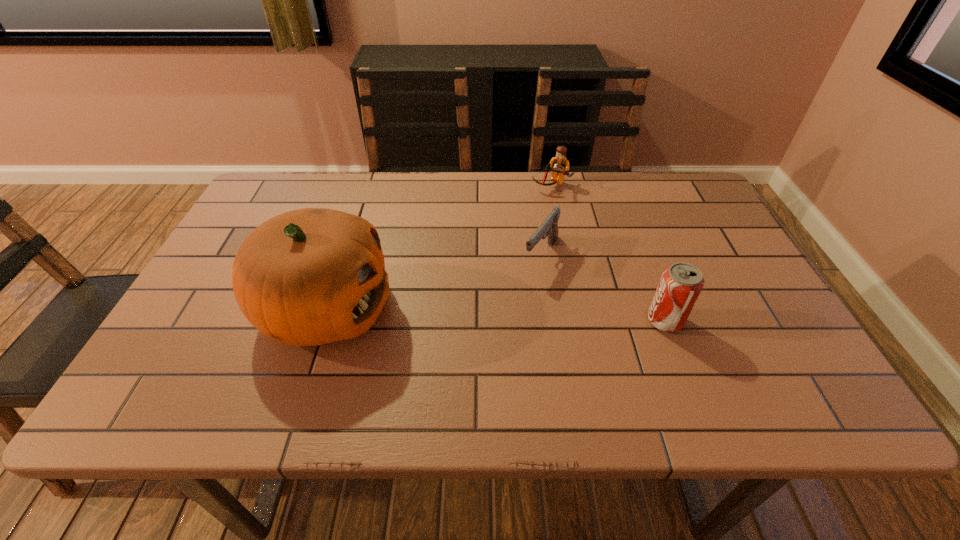
You are a GUI agent. You are given a task and a screenshot of the screen. Output one action in this format:
    pyautogui.click(x=<x>, y=<y>)
    Task: Click on the leftmost object
    The image size is (960, 540).
    Given the screenshot: What is the action you would take?
    pyautogui.click(x=307, y=277)

You are a GUI agent. You are given a task and a screenshot of the screen. Output one action in this format:
    pyautogui.click(x=<x>, y=<y>)
    Task: Click on the tallest object
    This screenshot has height=540, width=960.
    Given the screenshot: What is the action you would take?
    pyautogui.click(x=307, y=277)

This screenshot has height=540, width=960. In order to click on the rightmost object in this screenshot , I will do `click(681, 283)`.

Where is `soda can`? The height and width of the screenshot is (540, 960). soda can is located at coordinates (681, 283).

Find the location of `the farthest object`. the farthest object is located at coordinates [560, 165].

I want to click on pistol, so click(549, 227).

Locate an element on the screen. free space located 0.240m on the face of the leftmost object is located at coordinates (498, 309).

Where is `free space located 0.300m on the left of the third shortest object`? free space located 0.300m on the left of the third shortest object is located at coordinates (511, 321).

Image resolution: width=960 pixels, height=540 pixels. I want to click on vacant area located 0.330m holding a crossbow in the hands of the Lego, so click(509, 264).

This screenshot has width=960, height=540. In order to click on vacant space located holding a crossbow in the hands of the Lego in this screenshot , I will do `click(525, 233)`.